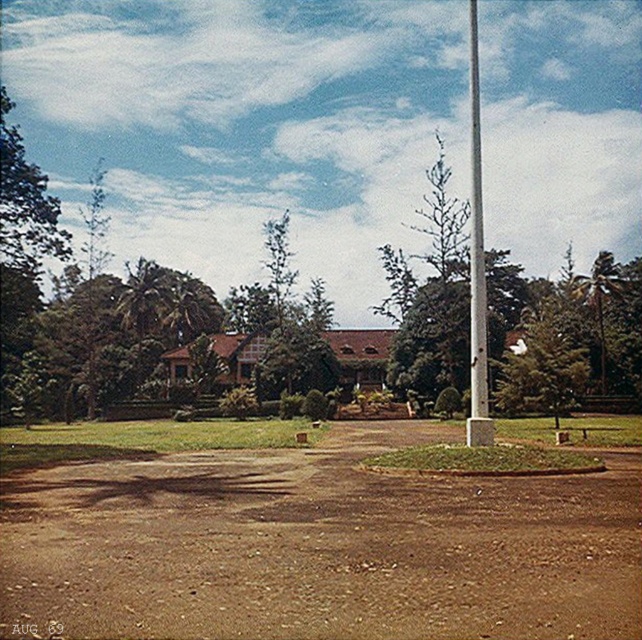
Is point (593, 560) positioned behind point (528, 342)?

No, it is in front of (528, 342).

Does brown dirt field at center have a lesser width compared to green leafy tree at center?

No.

The height and width of the screenshot is (640, 642). Identify the location of brown dirt field at center. (321, 547).

Who is shorter, brown dirt field at center or white glossy pole at center?

brown dirt field at center is shorter.

Who is more distant from viewer, (302, 561) or (480, 276)?

Point (480, 276)

Based on the photo, who is more distant from viewer, (535, 525) or (476, 332)?

The point (476, 332) is behind.

Locate an element on the screen. brown dirt field at center is located at coordinates (321, 547).

Does point (498, 401) come farther from viewer compared to point (478, 92)?

No, (498, 401) is in front of (478, 92).

Between point (548, 387) and point (478, 438), which one is positioned in front?

Point (478, 438)

Identify the location of green leafy tree at center. (541, 365).